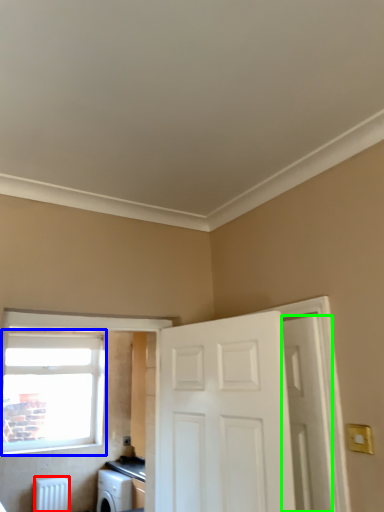
Question: Estimate the real-world distances between objects in this image. Which object is farther from radiator (highlighted by a red box), window (highlighted by a blue box) or door (highlighted by a green box)?

Choices:
 (A) window
 (B) door

Answer: (B)